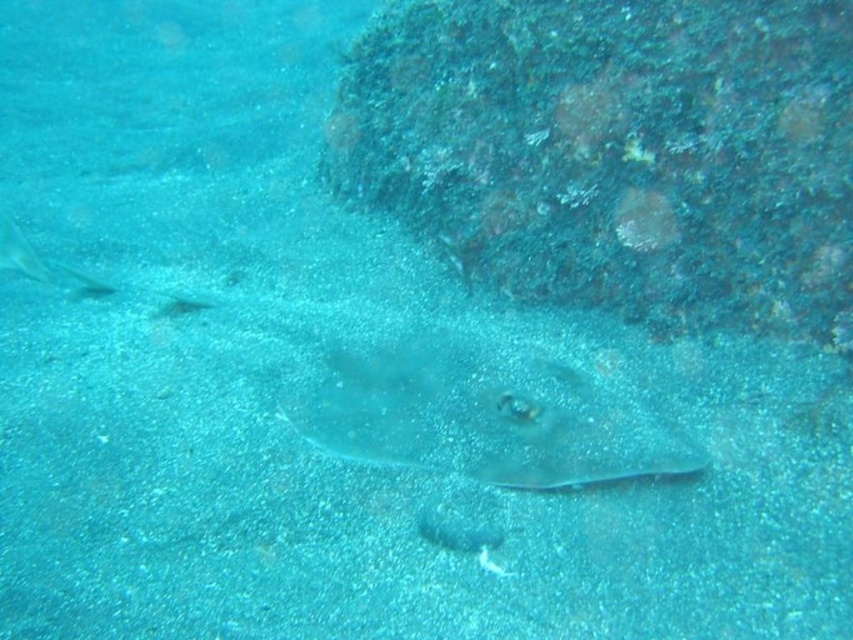
Question: Is rough textured rock at upper right above translucent rubber stingray at center?

Choices:
 (A) no
 (B) yes

Answer: (B)

Question: Is the position of rough textured rock at upper right more distant than that of translucent rubber stingray at center?

Choices:
 (A) yes
 (B) no

Answer: (B)

Question: Which point is closer to the camera?

Choices:
 (A) (433, 72)
 (B) (689, 452)

Answer: (B)

Question: Can you confirm if rough textured rock at upper right is positioned above translucent rubber stingray at center?

Choices:
 (A) yes
 (B) no

Answer: (A)

Question: Which of the following is the closest to the observer?

Choices:
 (A) translucent rubber stingray at center
 (B) rough textured rock at upper right

Answer: (B)

Question: Which point appears farthest from the camera in this image?

Choices:
 (A) (440, 332)
 (B) (780, 218)

Answer: (A)